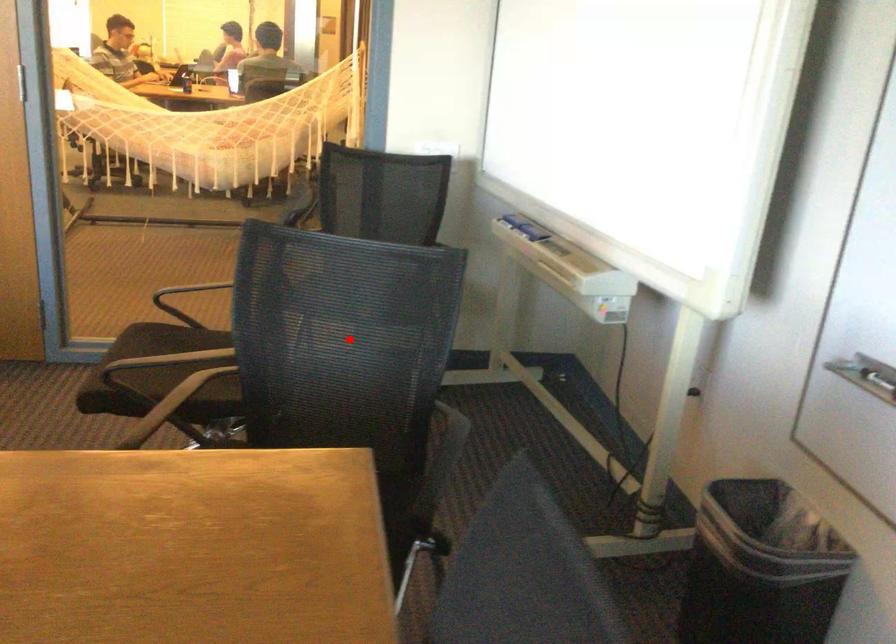
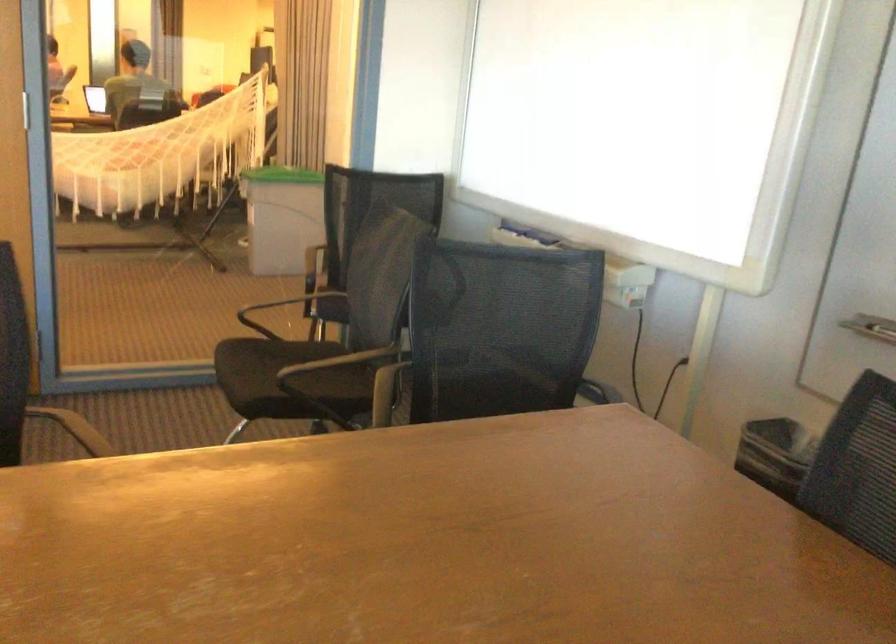
Find the pixel in the second image that matches the highlighted location in the first image.

(501, 328)